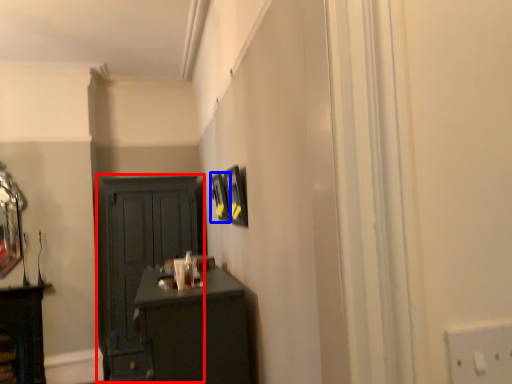
Question: Among these objects, which one is nearest to the camera, cupboard (highlighted by a red box) or picture frame (highlighted by a blue box)?

Choices:
 (A) cupboard
 (B) picture frame

Answer: (B)